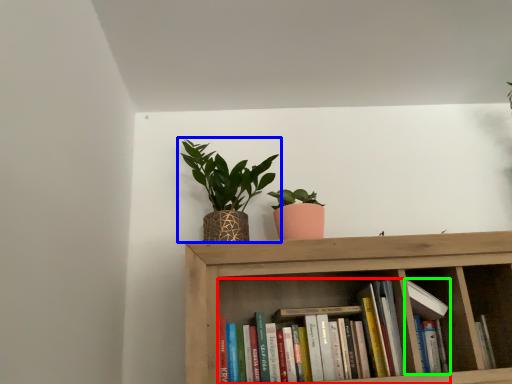
Question: Estimate the real-world distances between objects in this image. Which object is farther from book (highlighted by a red box), houseplant (highlighted by a blue box) or book (highlighted by a green box)?

Choices:
 (A) houseplant
 (B) book

Answer: (A)